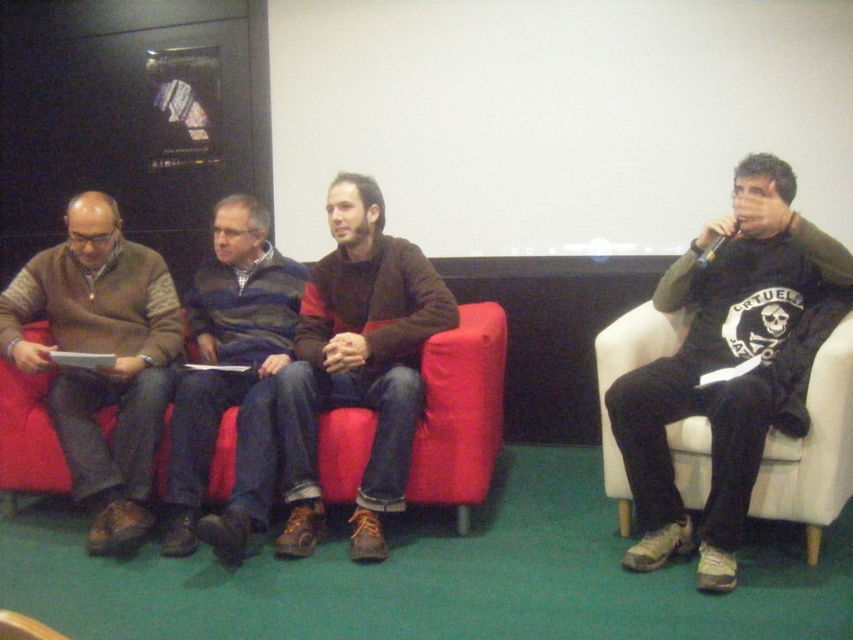
Based on the scene description, which object is narrower between the blue striped sweater at center and the red fabric couch at center?

The blue striped sweater at center is narrower than the red fabric couch at center.

Looking at the scene described, which object is smaller in size between the brown suede jacket at center and the matte brown sweater at left?

The brown suede jacket at center is smaller than the matte brown sweater at left.